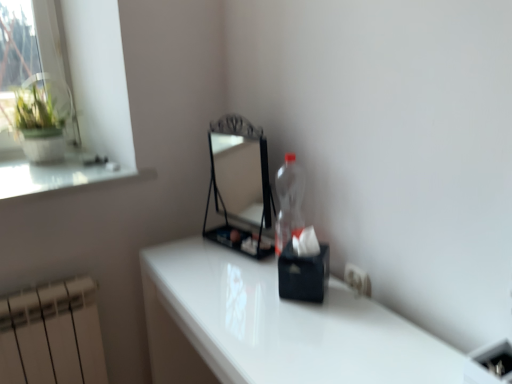
Locate an element on the screen. This screenshot has height=384, width=512. blank space above white glossy table at center (from a real-world perspective) is located at coordinates (276, 308).